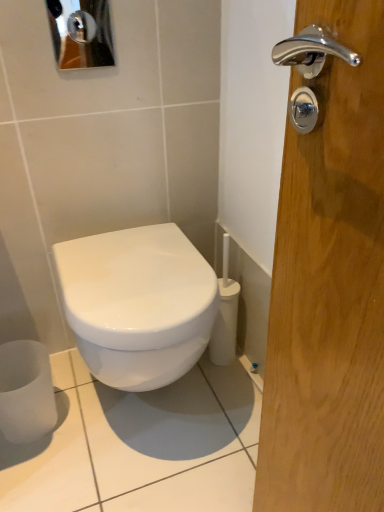
Question: Considering the positions of white glossy toilet at center and satin white toilet paper at lower left in the image, is white glossy toilet at center bigger or smaller than satin white toilet paper at lower left?

Choices:
 (A) small
 (B) big

Answer: (B)

Question: Based on their positions, is white glossy toilet at center located to the left or right of satin white toilet paper at lower left?

Choices:
 (A) left
 (B) right

Answer: (B)

Question: Which object is the farthest from the metallic reflective mirror at upper left?

Choices:
 (A) satin white toilet paper at lower left
 (B) white glossy toilet at center

Answer: (A)

Question: Which object is the closest to the white glossy toilet at center?

Choices:
 (A) metallic reflective mirror at upper left
 (B) satin white toilet paper at lower left

Answer: (B)